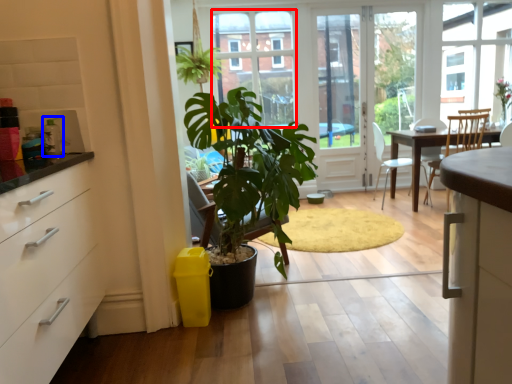
Question: Which object is closer to the camera taking this photo, bay window (highlighted by a red box) or appliance (highlighted by a blue box)?

Choices:
 (A) bay window
 (B) appliance

Answer: (B)